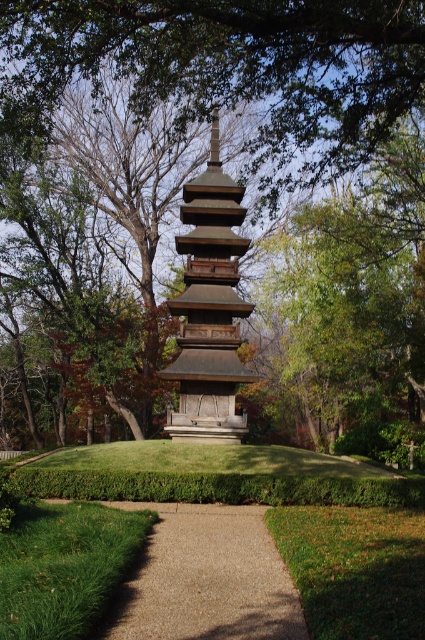
Question: Among these objects, which one is nearest to the camera?

Choices:
 (A) brown wooden pagoda at center
 (B) green leafy tree at center

Answer: (B)

Question: Is green leafy tree at center below brown wooden pagoda at center?

Choices:
 (A) no
 (B) yes

Answer: (A)

Question: Considering the real-world distances, which object is closest to the green leafy tree at center?

Choices:
 (A) gravel path at center
 (B) brown wooden pagoda at center

Answer: (B)

Question: Which object appears farthest from the camera in this image?

Choices:
 (A) brown wooden pagoda at center
 (B) green leafy tree at center
 (C) gravel path at center

Answer: (A)

Question: Is green leafy tree at center behind gravel path at center?

Choices:
 (A) yes
 (B) no

Answer: (A)

Question: Is the position of green leafy tree at center more distant than that of brown wooden pagoda at center?

Choices:
 (A) yes
 (B) no

Answer: (B)